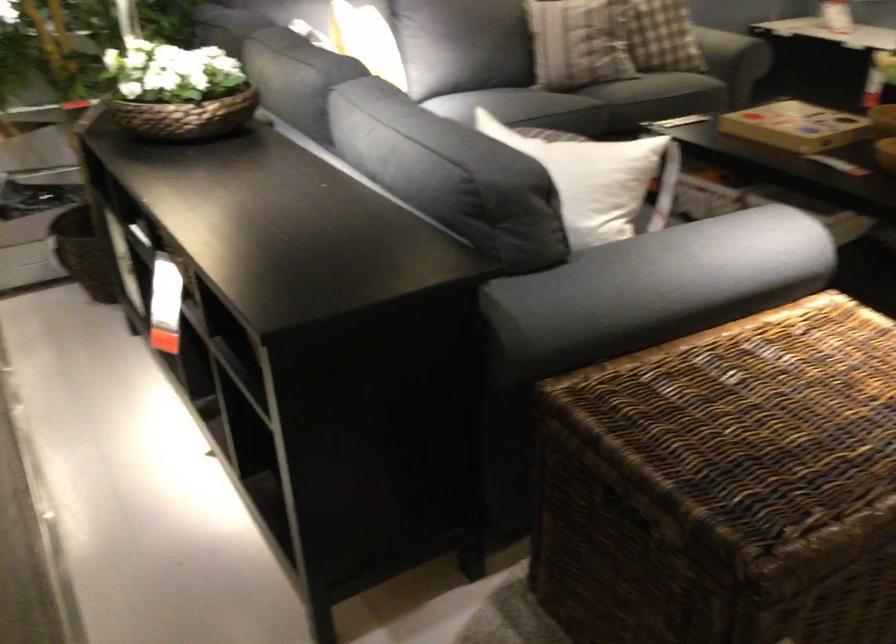
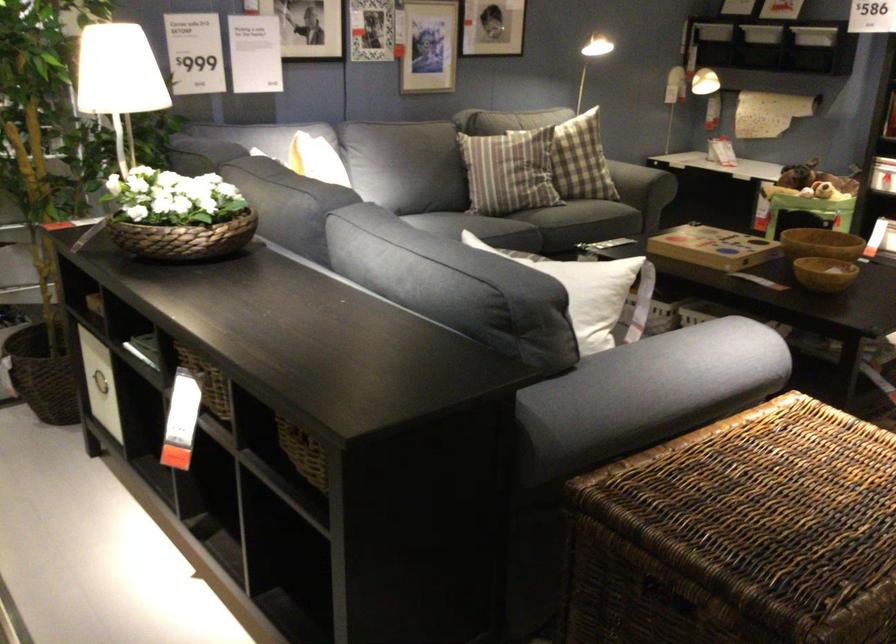
Find the pixel in the second image that matches point 597,153 in the first image.

(581, 272)